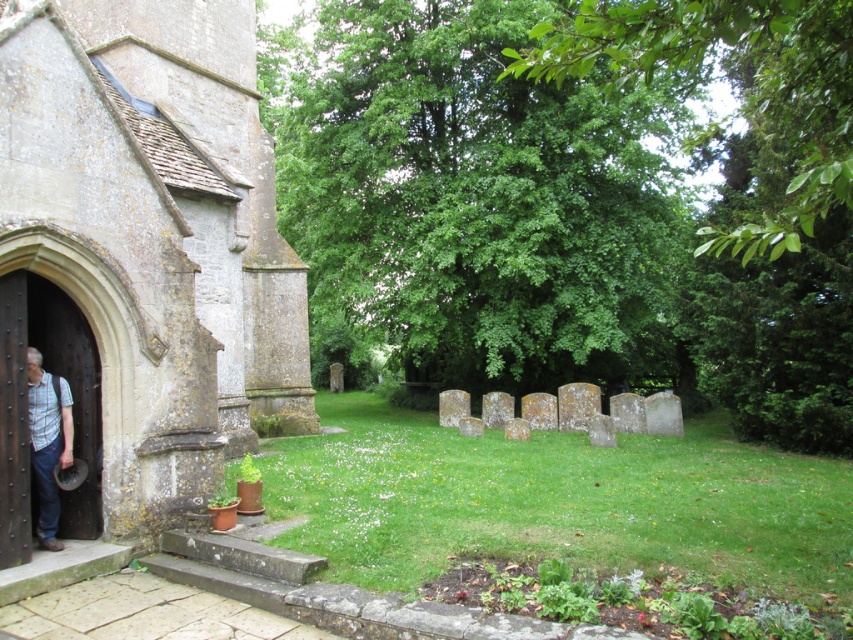
You are standing in the churchyard and want to take a photo of both the stone church at left and the wooden door at left. Which object should you focus on first to ensure both are in the frame?

You should focus on the stone church at left first because it is closer to the viewer than the wooden door at left, so adjusting the camera to include the closer object will help both be in the frame.